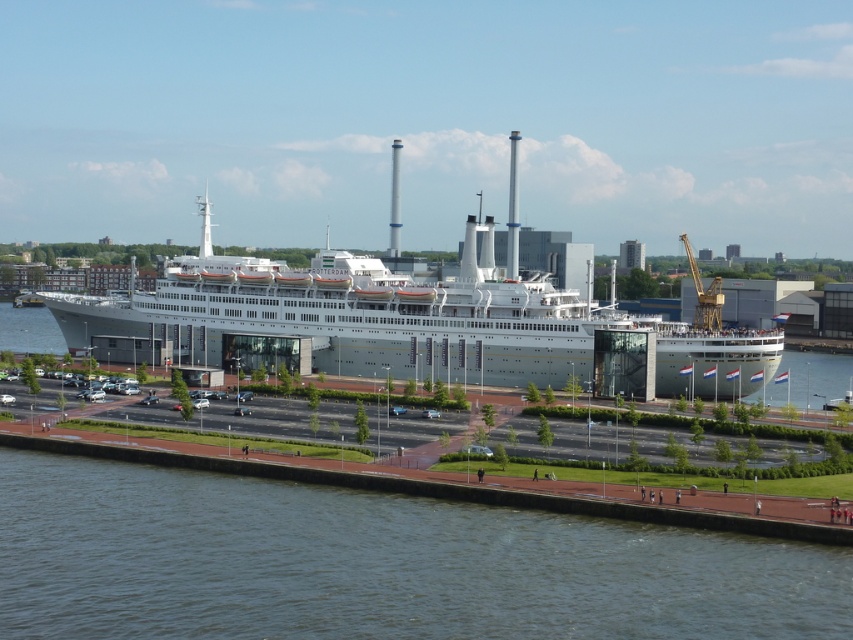
Is dark blue water at lower center smaller than silver metallic cruise ship at center?

Correct, dark blue water at lower center occupies less space than silver metallic cruise ship at center.

Is the position of dark blue water at lower center more distant than that of silver metallic cruise ship at center?

No, it is in front of silver metallic cruise ship at center.

Is point (451, 580) behind point (426, 365)?

No.

This screenshot has width=853, height=640. What are the coordinates of `dark blue water at lower center` in the screenshot? It's located at (374, 564).